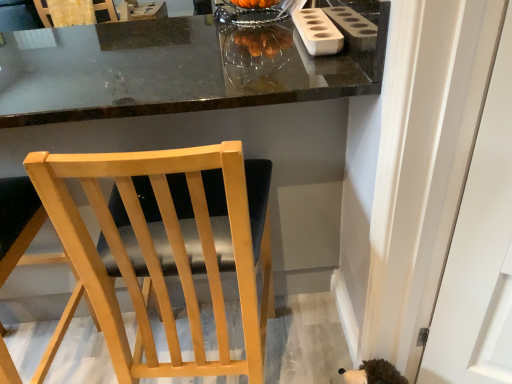
Question: From a real-world perspective, relative to matte black table at center, is light wood chair at center, acting as the 1th chair starting from the right, vertically above or below?

Choices:
 (A) above
 (B) below

Answer: (B)

Question: Is light wood chair at center, acting as the third chair starting from the left, inside the boundaries of matte black table at center, or outside?

Choices:
 (A) inside
 (B) outside

Answer: (A)

Question: Considering the real-world distances, which object is farthest from the white matte holder at upper right?

Choices:
 (A) matte black table at center
 (B) light wood chair at center, acting as the third chair starting from the back
 (C) wooden chair at upper left, which is the third chair from bottom to top
 (D) light wood chair at center, which is counted as the 2th chair, starting from the left

Answer: (C)

Question: Which object is positioned closest to the matte black table at center?

Choices:
 (A) light wood chair at center, acting as the third chair starting from the back
 (B) light wood chair at center, marked as the second chair in a front-to-back arrangement
 (C) white matte holder at upper right
 (D) wooden chair at upper left, the 1th chair viewed from the left

Answer: (A)